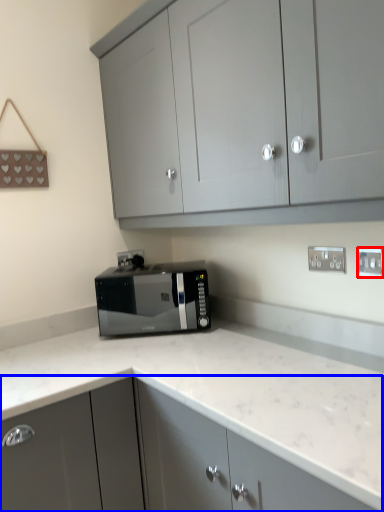
Question: Which of the following is the farthest to the observer, electric outlet (highlighted by a red box) or cabinetry (highlighted by a blue box)?

Choices:
 (A) electric outlet
 (B) cabinetry

Answer: (A)